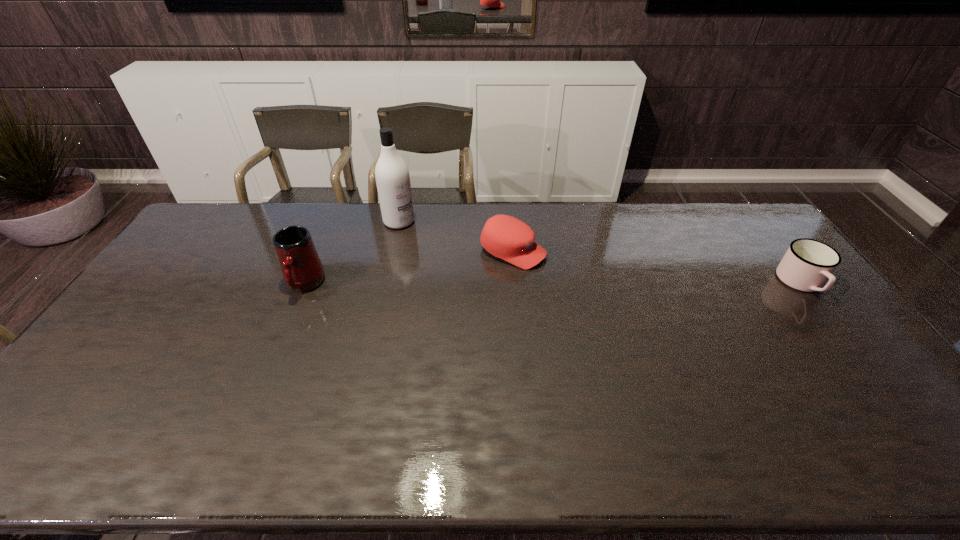
Where is `vacant area at the left edge of the desktop`? vacant area at the left edge of the desktop is located at coordinates (149, 359).

Where is `vacant space at the right edge of the desktop`? This screenshot has height=540, width=960. vacant space at the right edge of the desktop is located at coordinates (806, 340).

Where is `vacant region between the leftmost object and the farthest object`? vacant region between the leftmost object and the farthest object is located at coordinates (352, 253).

Where is `blank region between the cap and the third shortest object`? This screenshot has height=540, width=960. blank region between the cap and the third shortest object is located at coordinates (409, 268).

Locate an element on the screen. Image resolution: width=960 pixels, height=540 pixels. empty space that is in between the right mug and the third object from left to right is located at coordinates (658, 267).

Where is `empty location between the right mug and the taller mug`? empty location between the right mug and the taller mug is located at coordinates (553, 284).

At what (x,y) coordinates should I click in order to perform the action: click on empty location between the rightmost object and the shampoo. Please return your answer as a coordinate pair (x, y). Looking at the image, I should click on (600, 252).

At what (x,y) coordinates should I click in order to perform the action: click on free spot between the shorter mug and the farthest object. Please return your answer as a coordinate pair (x, y). Image resolution: width=960 pixels, height=540 pixels. Looking at the image, I should click on (600, 252).

Locate an element on the screen. The image size is (960, 540). vacant space in between the shampoo and the right mug is located at coordinates (600, 252).

I want to click on blank region between the left mug and the tallest object, so click(352, 253).